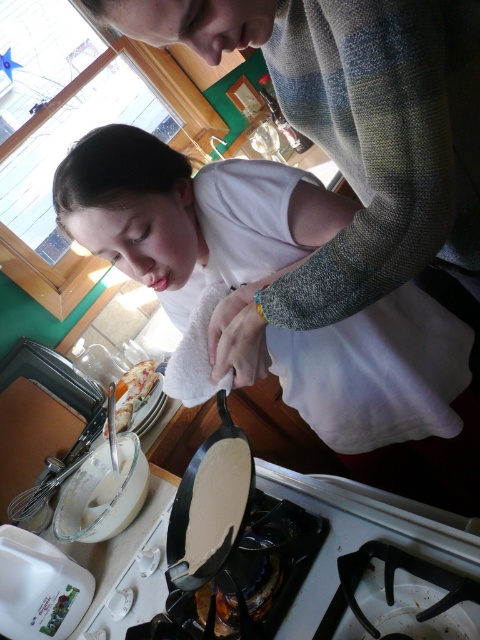
Question: Is the position of black cast iron frying pan at center less distant than that of golden crispy bread at center?

Choices:
 (A) yes
 (B) no

Answer: (A)

Question: Which point is farther to the camera?

Choices:
 (A) golden crispy bread at center
 (B) black cast iron frying pan at center

Answer: (A)

Question: Which point is farther from the camera taking this photo?

Choices:
 (A) (408, 348)
 (B) (324, 490)
 (C) (132, 372)

Answer: (C)

Question: Can you confirm if white glossy gas stove at lower center is bigger than golden crispy bread at center?

Choices:
 (A) yes
 (B) no

Answer: (A)

Question: Where is matte white towel at center located in relation to black cast iron frying pan at center in the image?

Choices:
 (A) right
 (B) left

Answer: (A)

Question: Which point appears closest to the camera in this image?

Choices:
 (A) (213, 564)
 (B) (120, 412)

Answer: (A)